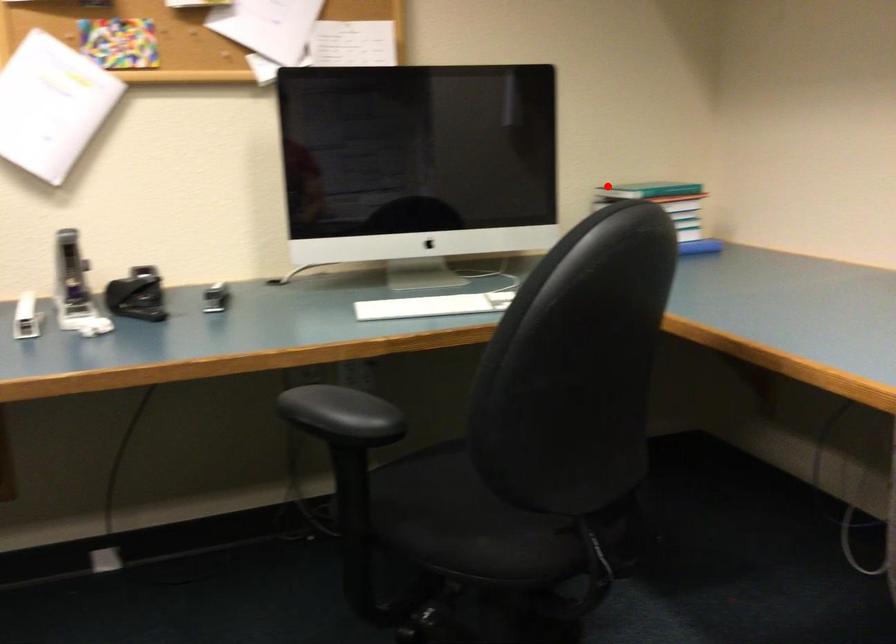
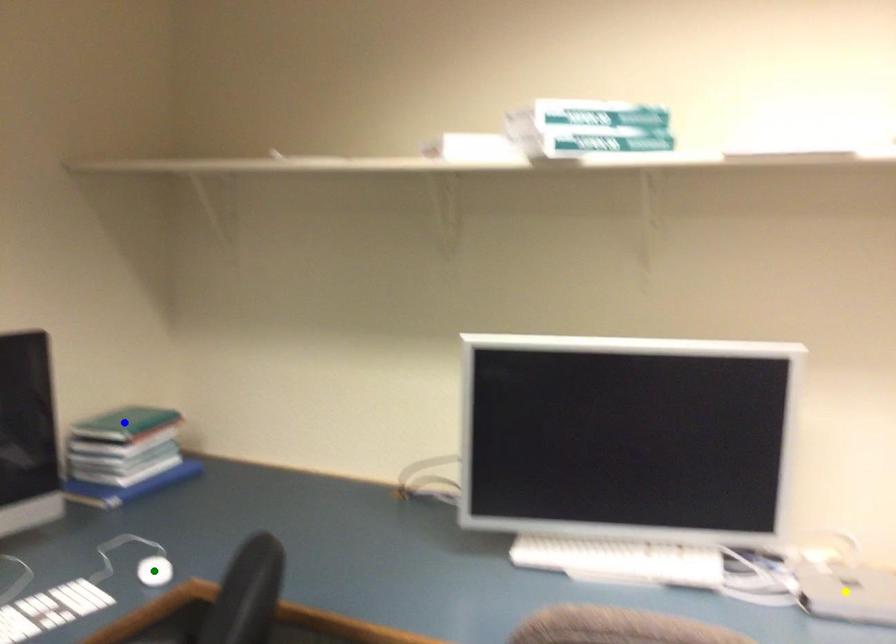
Question: I am providing you with two images of the same scene from different viewpoints. A red point is marked on the first image. You are given multiple points on the second image. Which mark in image 2 goes with the point in image 1?

Choices:
 (A) green point
 (B) yellow point
 (C) blue point

Answer: (C)